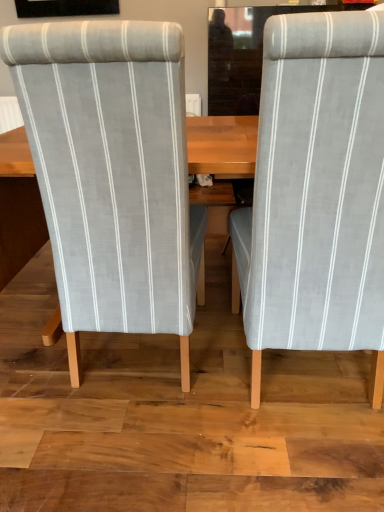
Find the location of a particular element. free space in front of light gray striped fabric chair at left, which appears as the first chair when viewed from the left is located at coordinates (139, 447).